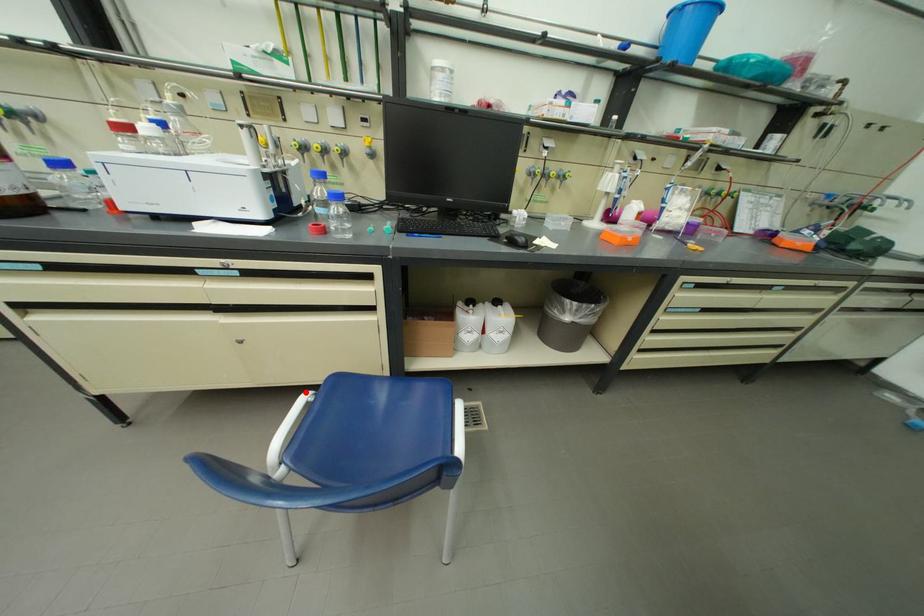
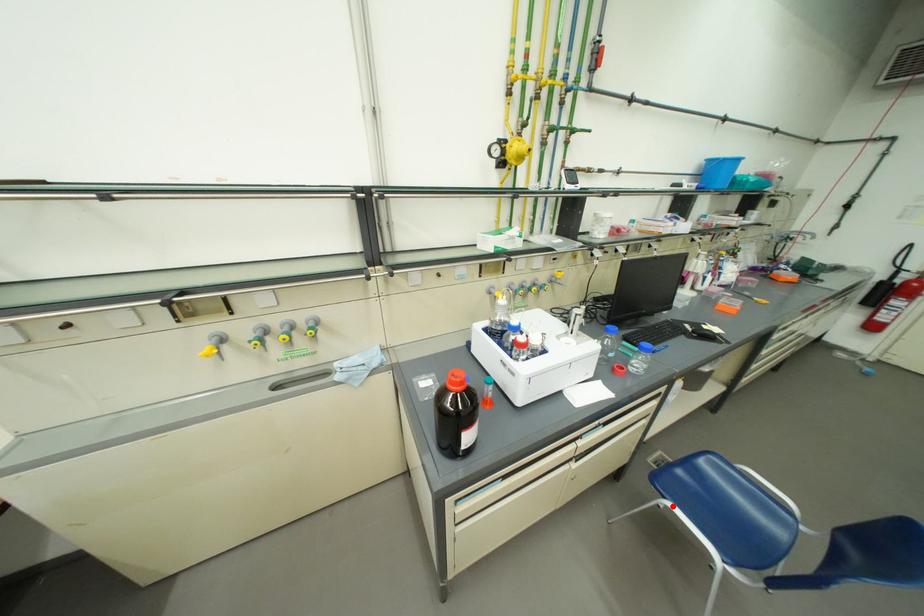
I am providing you with two images of the same scene from different viewpoints. A red point is marked on the first image and another point is marked on the second image. Is the red point in image1 aligned with the point shown in image2?

Yes